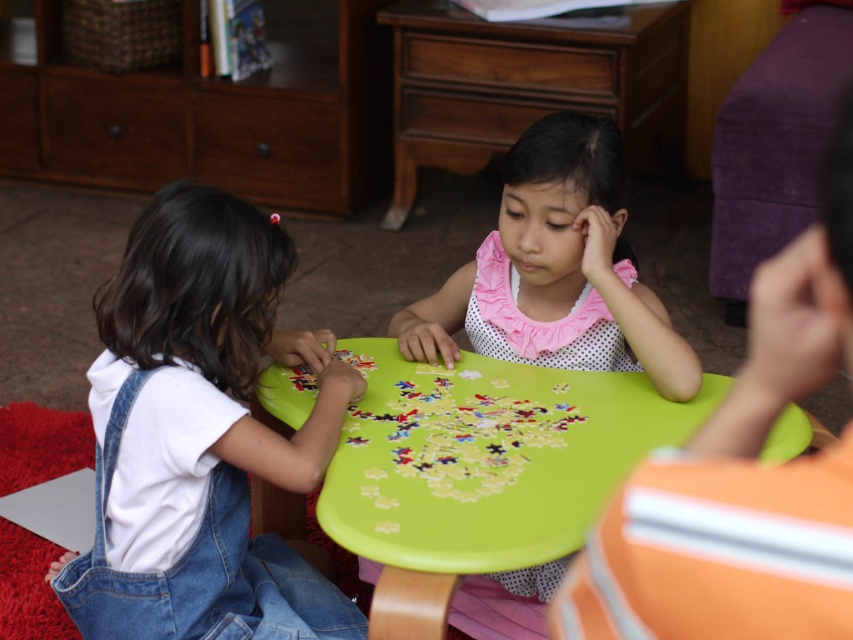
Question: Is white denim overalls at left to the left of green plastic table at center from the viewer's perspective?

Choices:
 (A) yes
 (B) no

Answer: (A)

Question: Which point is closer to the camera?

Choices:
 (A) (442, 490)
 (B) (119, 506)

Answer: (A)

Question: Which object is positioned farthest from the pink polka dot dress at center?

Choices:
 (A) white denim overalls at left
 (B) green plastic puzzle at center

Answer: (A)

Question: Does green plastic table at center come behind green plastic puzzle at center?

Choices:
 (A) yes
 (B) no

Answer: (B)

Question: Estimate the real-world distances between objects in this image. Which object is closer to the white denim overalls at left?

Choices:
 (A) green plastic puzzle at center
 (B) pink polka dot dress at center
 (C) green plastic table at center

Answer: (A)

Question: Can you confirm if white denim overalls at left is positioned below pink polka dot dress at center?

Choices:
 (A) no
 (B) yes

Answer: (B)